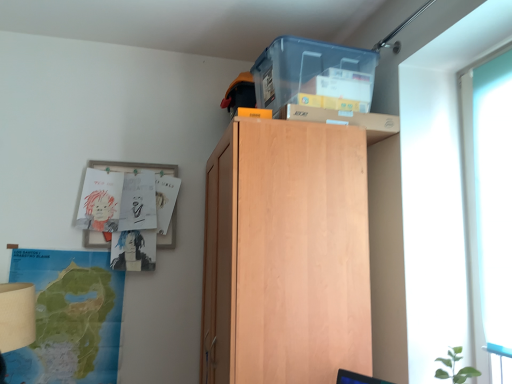
Question: Is the position of light wood cabinet at upper center more distant than that of transparent glass door at right?

Choices:
 (A) no
 (B) yes

Answer: (B)

Question: From a real-world perspective, is light wood cabinet at upper center below transparent glass door at right?

Choices:
 (A) yes
 (B) no

Answer: (A)

Question: Is light wood cabinet at upper center taller than transparent glass door at right?

Choices:
 (A) yes
 (B) no

Answer: (A)

Question: Considering the relative sizes of light wood cabinet at upper center and transparent glass door at right in the image provided, is light wood cabinet at upper center bigger than transparent glass door at right?

Choices:
 (A) no
 (B) yes

Answer: (B)

Question: Is light wood cabinet at upper center smaller than transparent glass door at right?

Choices:
 (A) no
 (B) yes

Answer: (A)

Question: From a real-world perspective, is light wood cabinet at upper center above or below green paper map at lower left?

Choices:
 (A) below
 (B) above

Answer: (B)

Question: Considering the positions of point (229, 382) and point (44, 256), is point (229, 382) closer or farther from the camera than point (44, 256)?

Choices:
 (A) farther
 (B) closer

Answer: (B)

Question: Based on their positions, is light wood cabinet at upper center located to the left or right of green paper map at lower left?

Choices:
 (A) right
 (B) left

Answer: (A)

Question: In terms of width, does light wood cabinet at upper center look wider or thinner when compared to green paper map at lower left?

Choices:
 (A) thin
 (B) wide

Answer: (B)

Question: Is transparent glass door at right spatially inside light wood cabinet at upper center, or outside of it?

Choices:
 (A) outside
 (B) inside

Answer: (A)

Question: Relative to light wood cabinet at upper center, is transparent glass door at right in front or behind?

Choices:
 (A) behind
 (B) front

Answer: (B)

Question: In terms of size, does transparent glass door at right appear bigger or smaller than light wood cabinet at upper center?

Choices:
 (A) big
 (B) small

Answer: (B)

Question: Based on their positions, is transparent glass door at right located to the left or right of light wood cabinet at upper center?

Choices:
 (A) left
 (B) right

Answer: (B)

Question: Is transparent glass door at right wider or thinner than green paper map at lower left?

Choices:
 (A) wide
 (B) thin

Answer: (A)

Question: Relative to green paper map at lower left, is transparent glass door at right in front or behind?

Choices:
 (A) behind
 (B) front

Answer: (B)